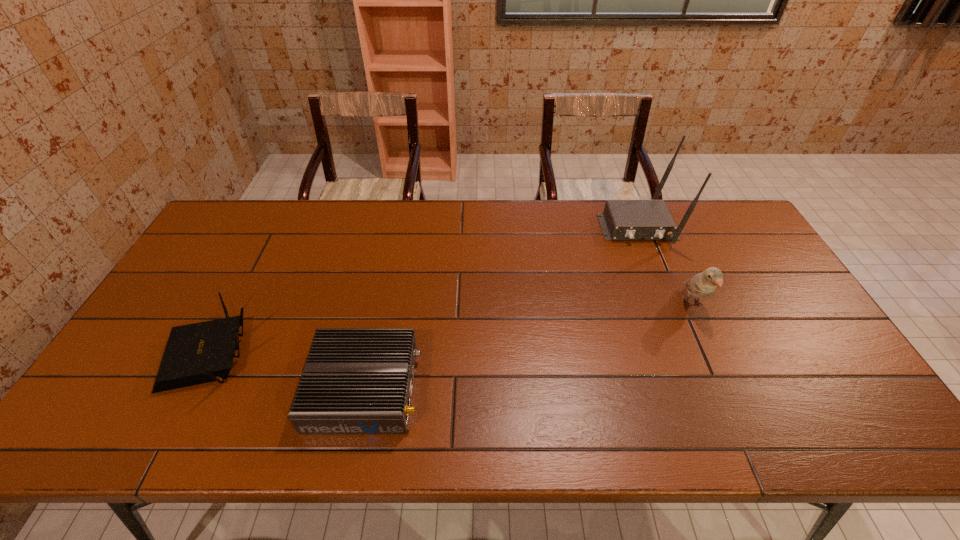
The height and width of the screenshot is (540, 960). I want to click on blank space located on the back panel of the second object from left to right, so click(574, 388).

At what (x,y) coordinates should I click in order to perform the action: click on object situated at the far edge. Please return your answer as a coordinate pair (x, y). The image size is (960, 540). Looking at the image, I should click on (622, 219).

This screenshot has width=960, height=540. What are the coordinates of `object at the near edge` in the screenshot? It's located at (355, 380).

Identify the location of object present at the left edge. The width and height of the screenshot is (960, 540). (198, 353).

Locate an element on the screen. vacant space at the far edge of the desktop is located at coordinates (271, 219).

In the image, there is a desktop. What are the coordinates of `vacant space at the near edge` in the screenshot? It's located at (281, 445).

At what (x,y) coordinates should I click in order to perform the action: click on blank area at the right edge. Please return your answer as a coordinate pair (x, y). Image resolution: width=960 pixels, height=540 pixels. Looking at the image, I should click on (816, 388).

Image resolution: width=960 pixels, height=540 pixels. I want to click on vacant space at the far left corner, so click(x=245, y=204).

Find the location of `free space at the near left corner of the desktop`. free space at the near left corner of the desktop is located at coordinates (154, 409).

Locate an element on the screen. Image resolution: width=960 pixels, height=540 pixels. free point between the shortest object and the second shortest object is located at coordinates (286, 371).